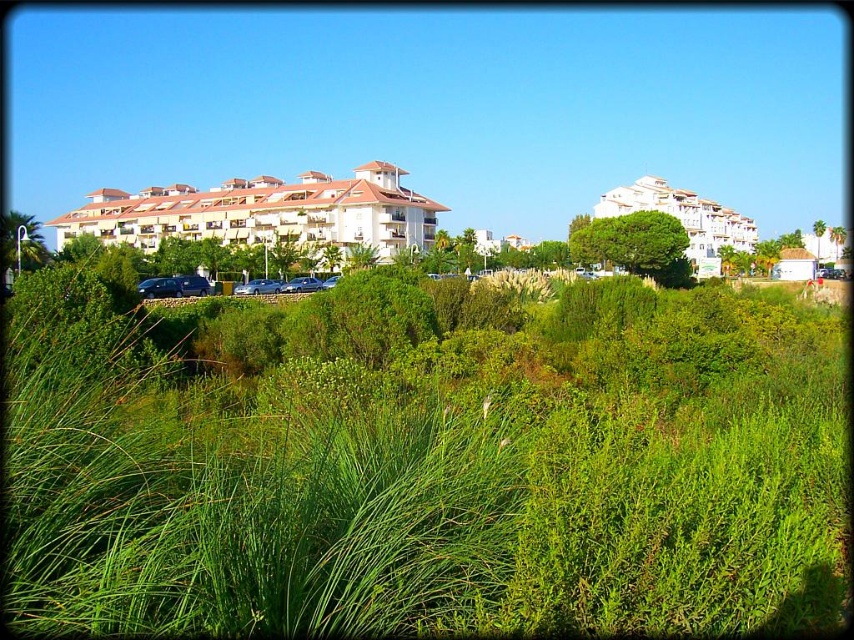
Question: Which point is closer to the camera?

Choices:
 (A) (303, 224)
 (B) (89, 422)

Answer: (B)

Question: Can you confirm if green leafy tree at upper right is wider than green leafy palm at left?

Choices:
 (A) no
 (B) yes

Answer: (B)

Question: Can you confirm if green leafy grass at center is positioned to the right of white matte building at upper right?

Choices:
 (A) yes
 (B) no

Answer: (B)

Question: Which object is farther from the camera taking this photo?

Choices:
 (A) green leafy palm at left
 (B) green leafy tree at upper right

Answer: (B)

Question: Does white matte building at center appear over green leafy tree at upper right?

Choices:
 (A) yes
 (B) no

Answer: (A)

Question: Which object is closer to the camera taking this photo?

Choices:
 (A) white matte building at upper right
 (B) green leafy grass at center
 (C) green leafy palm at left

Answer: (B)